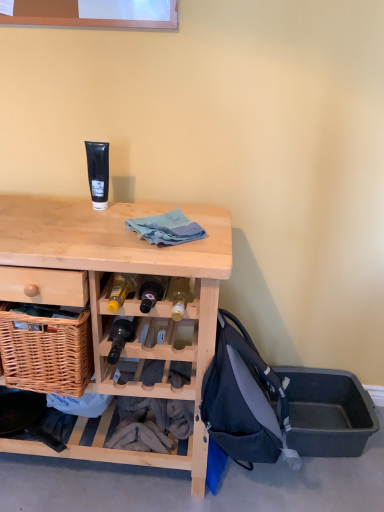
I want to click on empty space that is ontop of light wood desk at center (from a real-world perspective), so click(x=105, y=227).